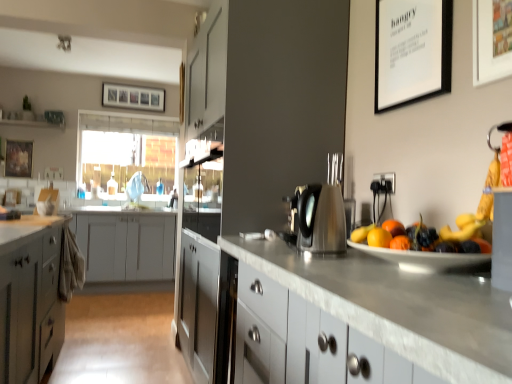
Question: Considering the positions of point (114, 162) and point (132, 195), is point (114, 162) closer or farther from the camera than point (132, 195)?

Choices:
 (A) farther
 (B) closer

Answer: (A)

Question: Is translucent plastic window screen at upper left to the left or to the right of satin nickel faucet at center in the image?

Choices:
 (A) right
 (B) left

Answer: (B)

Question: Based on their relative distances, which object is nearer to the satin silver kettle at center?

Choices:
 (A) white matte picture frame at upper right, arranged as the third picture frame when viewed from the left
 (B) satin nickel faucet at center
 (C) translucent plastic window screen at upper left
 (D) wooden picture frame at upper center, arranged as the 1th picture frame when viewed from the back
 (E) satin gray cabinet at center

Answer: (A)

Question: Based on their relative distances, which object is nearer to the satin gray cabinet at center?

Choices:
 (A) white matte picture frame at upper right, the 4th picture frame when ordered from back to front
 (B) white matte picture frame at upper right, marked as the 3th picture frame in a back-to-front arrangement
 (C) satin nickel faucet at center
 (D) wooden picture frame at upper center, arranged as the 1th picture frame when viewed from the back
 (E) satin silver kettle at center

Answer: (E)